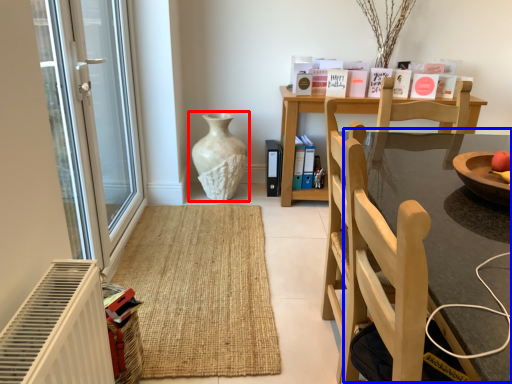
Question: Which object appears farthest to the camera in this image, vase (highlighted by a red box) or round table (highlighted by a blue box)?

Choices:
 (A) vase
 (B) round table

Answer: (A)